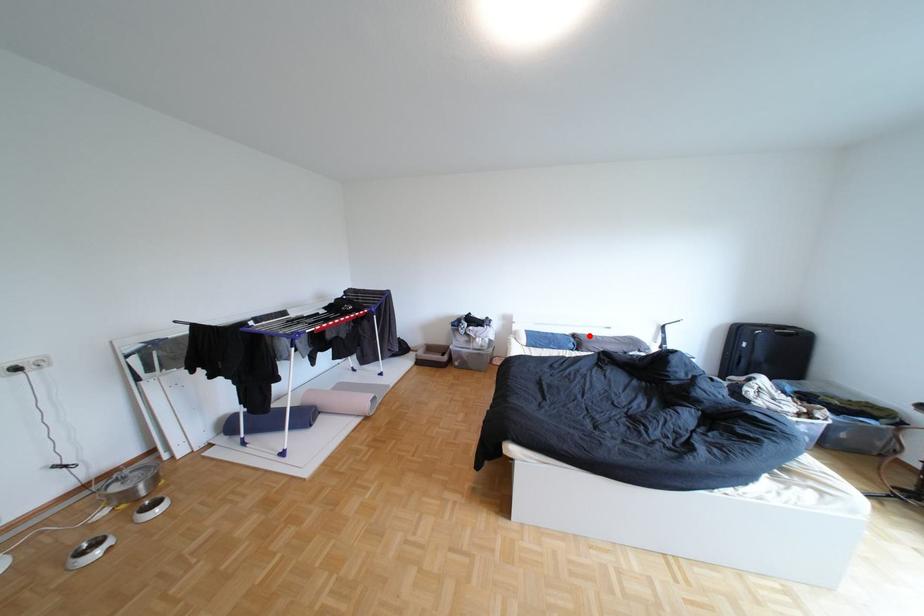
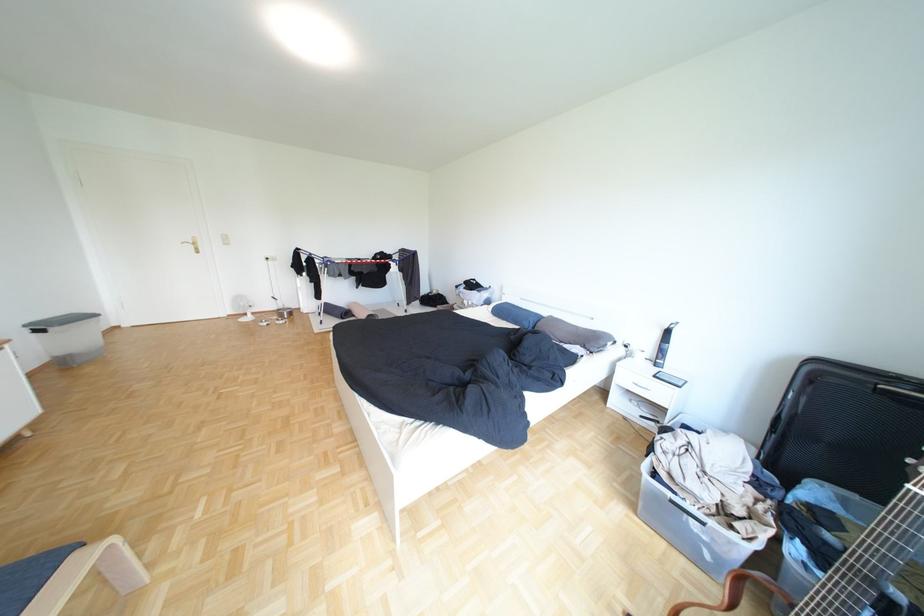
Locate, in the second image, the point that corresponds to the highlighted location in the first image.

(564, 318)